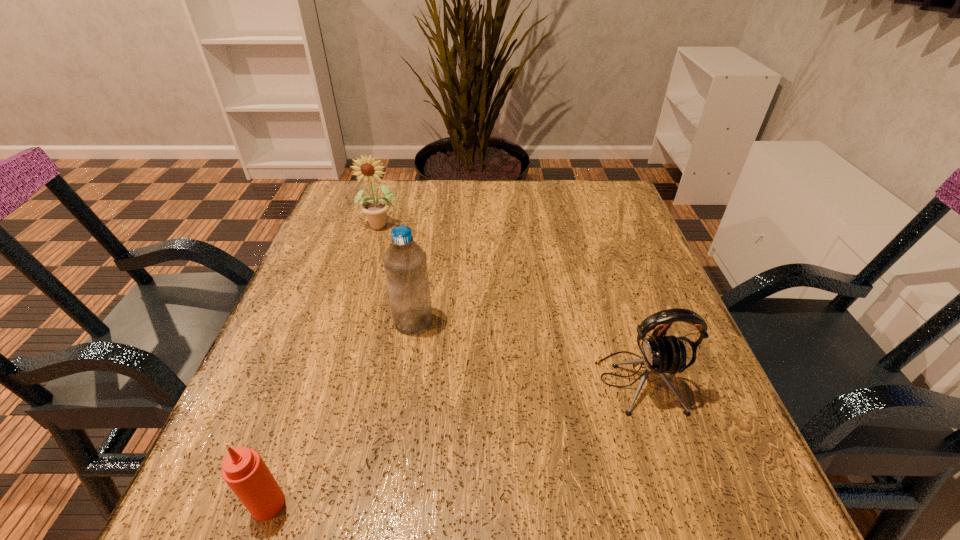
You are a GUI agent. You are given a task and a screenshot of the screen. Output one action in this format:
    pyautogui.click(x=<x>, y=<y>)
    Task: Click on the free space between the sunflower and the nearest object
    The width and height of the screenshot is (960, 540).
    Given the screenshot: What is the action you would take?
    pyautogui.click(x=325, y=364)

Find the location of a particular element. The image size is (960, 540). free spot between the third farthest object and the Tabasco sauce is located at coordinates (453, 443).

This screenshot has width=960, height=540. Find the location of `vacant space that is in between the second object from right to left and the shortest object`. vacant space that is in between the second object from right to left and the shortest object is located at coordinates (341, 413).

This screenshot has width=960, height=540. Identify the location of free space between the farthest object and the shortest object. (325, 364).

At what (x,y) coordinates should I click in order to perform the action: click on object that is the second closest to the third object from left to right. Please return your answer as a coordinate pair (x, y). Looking at the image, I should click on (660, 355).

Identify which object is the nearest to the sunflower. Please provide its 2D coordinates. Your answer should be formatted as a tuple, i.e. [(x, y)], where the tuple contains the x and y coordinates of a point satisfying the conditions above.

[(405, 263)]

The image size is (960, 540). Find the location of `vacant region that satisfies the following two spatial constraints: 1. on the back side of the water bottle; 2. on the left side of the shortest object`. vacant region that satisfies the following two spatial constraints: 1. on the back side of the water bottle; 2. on the left side of the shortest object is located at coordinates [331, 321].

At what (x,y) coordinates should I click in order to perform the action: click on vacant space that satisfies the following two spatial constraints: 1. on the front-facing side of the earphone; 2. on the right side of the sunflower. Please return your answer as a coordinate pair (x, y). The height and width of the screenshot is (540, 960). Looking at the image, I should click on (335, 382).

Find the location of a particular element. This screenshot has height=540, width=960. vacant region that satisfies the following two spatial constraints: 1. on the front-facing side of the water bottle; 2. on the right side of the farthest object is located at coordinates (353, 321).

Where is `vacant point that satisfies the following two spatial constraints: 1. on the front-facing side of the second farthest object; 2. on the right side of the farthest object`? This screenshot has height=540, width=960. vacant point that satisfies the following two spatial constraints: 1. on the front-facing side of the second farthest object; 2. on the right side of the farthest object is located at coordinates (353, 321).